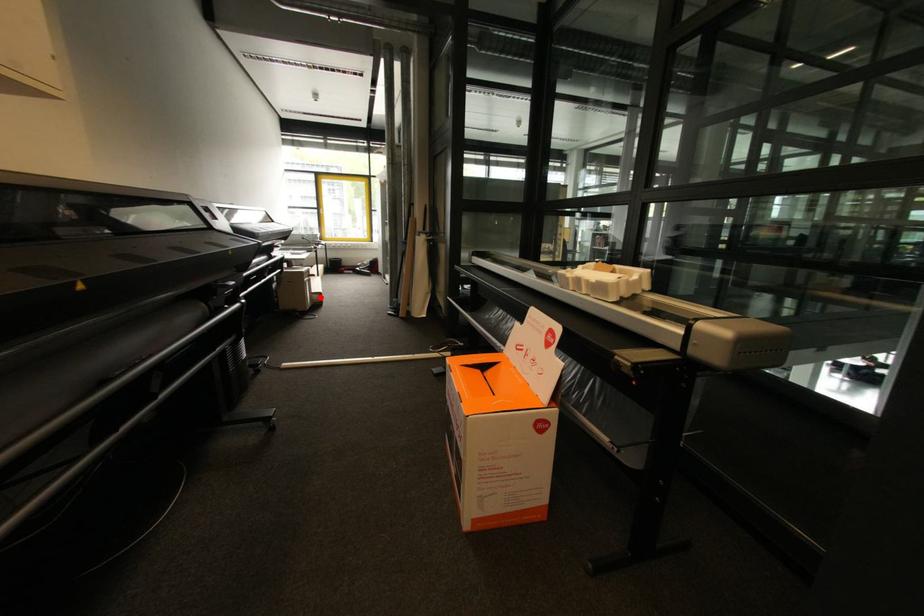
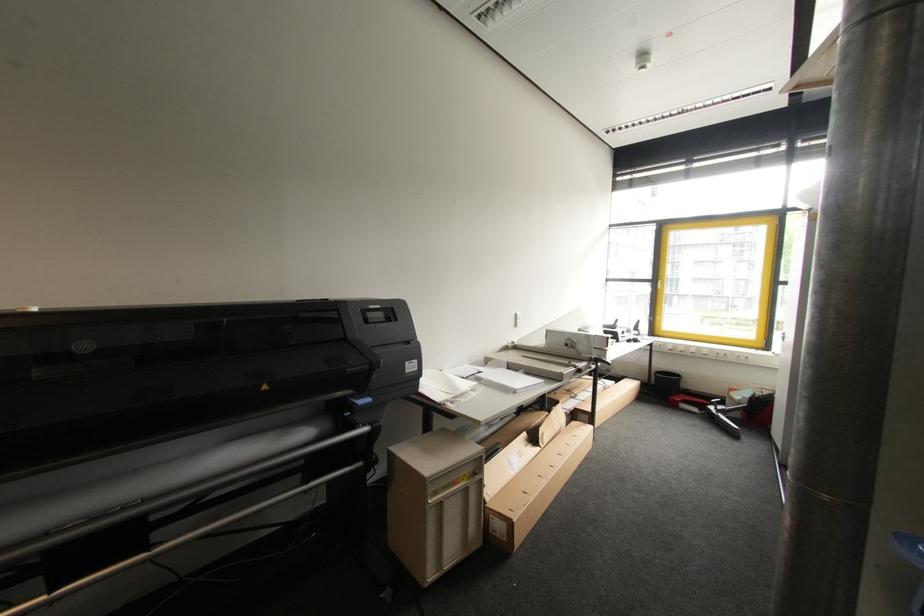
Question: I am providing you with two images of the same scene from different viewpoints. In image1, a red point is highlighted. Considering the same 3D point in image2, which of the following is correct?

Choices:
 (A) It is closer
 (B) It is farther

Answer: (B)